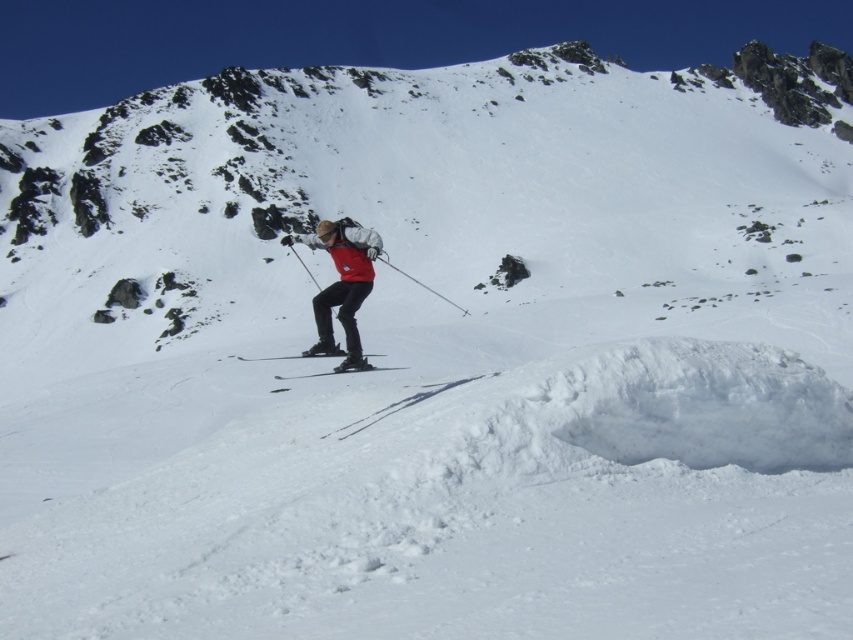
Question: Is matte red jacket at center closer to the viewer compared to matte black ski at center?

Choices:
 (A) no
 (B) yes

Answer: (B)

Question: Which point appears farthest from the camera in this image?

Choices:
 (A) (349, 362)
 (B) (302, 356)
 (C) (390, 368)

Answer: (C)

Question: Is matte red jacket at center wider than metallic silver ski pole at center?

Choices:
 (A) yes
 (B) no

Answer: (A)

Question: Based on their relative distances, which object is nearer to the matte red jacket at center?

Choices:
 (A) metallic silver ski pole at center
 (B) matte black skis at center

Answer: (A)

Question: Is matte red jacket at center positioned before matte black ski at center?

Choices:
 (A) yes
 (B) no

Answer: (A)

Question: Among these objects, which one is farthest from the camera?

Choices:
 (A) matte red jacket at center
 (B) metallic silver ski pole at center
 (C) matte black ski at center
 (D) matte black skis at center

Answer: (C)